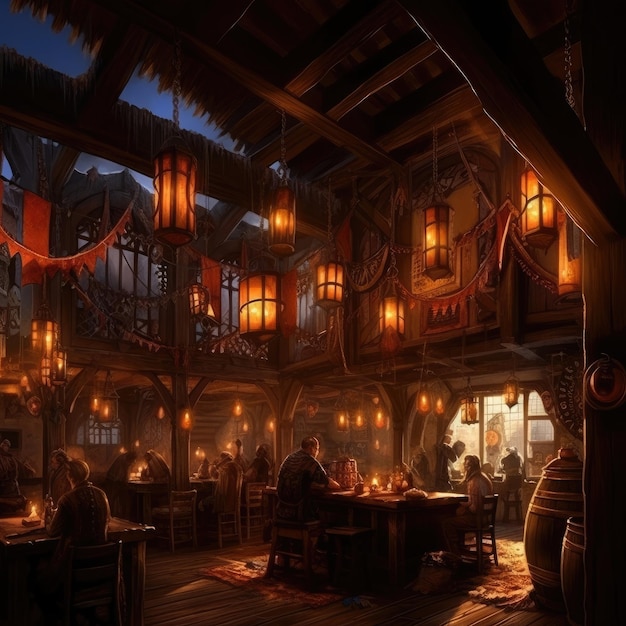
Locate an element on the screen. This screenshot has height=626, width=626. wall is located at coordinates (33, 454).